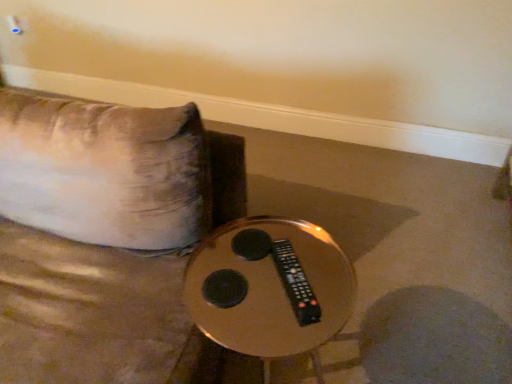
Where is `free space that is to the left of black plastic remote at center`? Image resolution: width=512 pixels, height=384 pixels. free space that is to the left of black plastic remote at center is located at coordinates (249, 273).